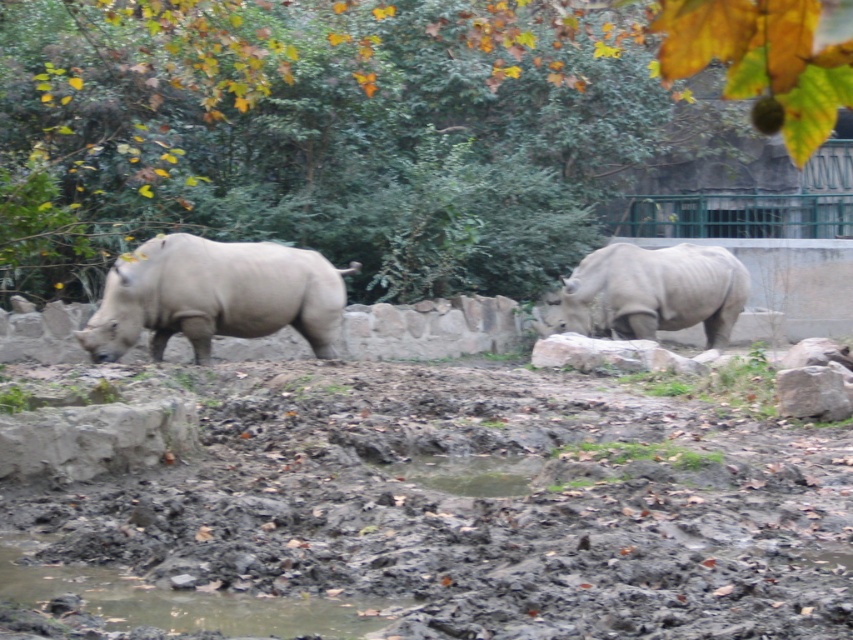
You are a zookeeper planning to place a new feeding station between the green leafy tree at upper center and the matte gray rhinoceros at left. Considering their sizes, which object should the feeding station be closer to?

The feeding station should be closer to the matte gray rhinoceros at left because the green leafy tree at upper center is bigger, so placing it closer to the smaller object would ensure better accessibility.

You are a zookeeper who needs to place a new feeding station in the zoo enclosure. The feeding station requires a stable, dry area to be placed. Based on the image, is the damp mud at lower center a suitable location for the feeding station?

The damp mud at lower center is located at point (480,504) and is described as damp, so it is not a suitable location for the feeding station as it is not dry.

You are a zookeeper planning to install a new feeding station between the green leafy tree at upper center and the matte gray rhinoceros at left. Considering their heights, which object will the feeding station need to be elevated above to ensure visibility?

The feeding station needs to be elevated above the green leafy tree at upper center because it is taller than the matte gray rhinoceros at left.